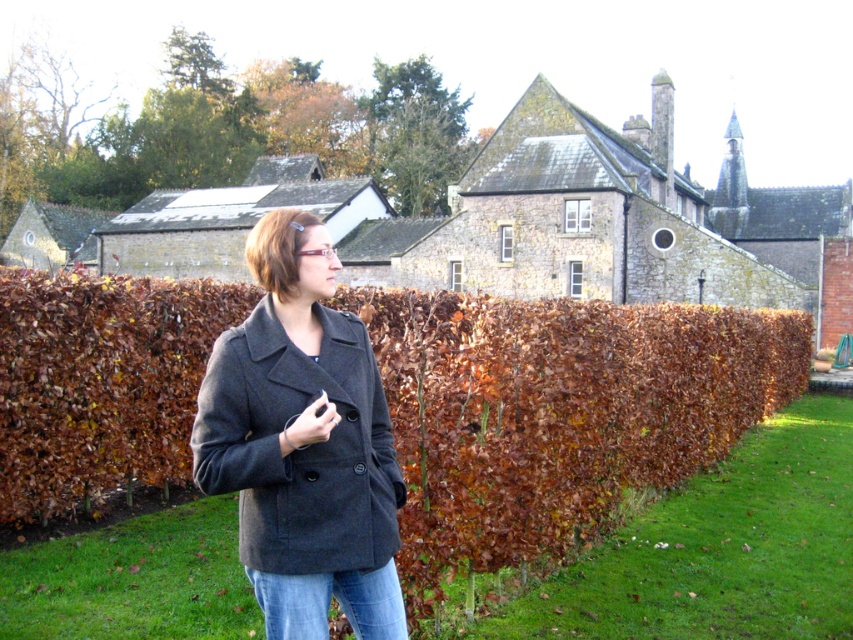
Question: Which object is farther from the camera taking this photo?

Choices:
 (A) brown leafy hedge at center
 (B) matte gray coat at center

Answer: (A)

Question: Can you confirm if brown leafy hedge at center is positioned below matte gray coat at center?

Choices:
 (A) yes
 (B) no

Answer: (B)

Question: Among these objects, which one is farthest from the camera?

Choices:
 (A) matte gray coat at center
 (B) brown leafy hedge at center

Answer: (B)

Question: Which point is farther to the camera?

Choices:
 (A) brown leafy hedge at center
 (B) matte gray coat at center

Answer: (A)

Question: Does brown leafy hedge at center appear on the left side of matte gray coat at center?

Choices:
 (A) yes
 (B) no

Answer: (B)

Question: Where is brown leafy hedge at center located in relation to matte gray coat at center in the image?

Choices:
 (A) above
 (B) below

Answer: (A)